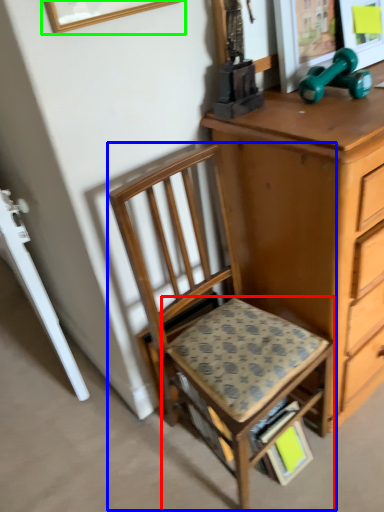
Question: Considering the real-world distances, which object is closest to step stool (highlighted by a red box)? chair (highlighted by a blue box) or picture frame (highlighted by a green box).

Choices:
 (A) chair
 (B) picture frame

Answer: (A)